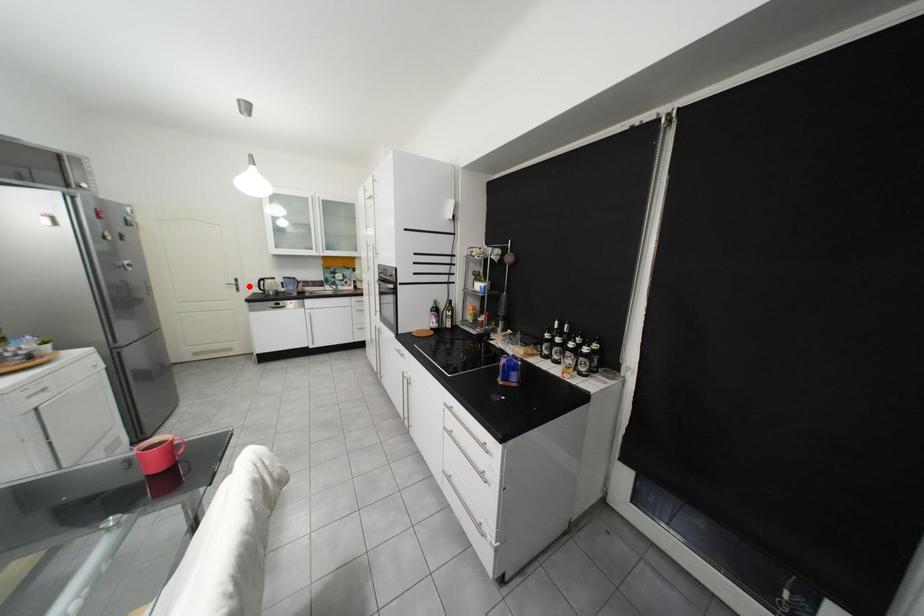
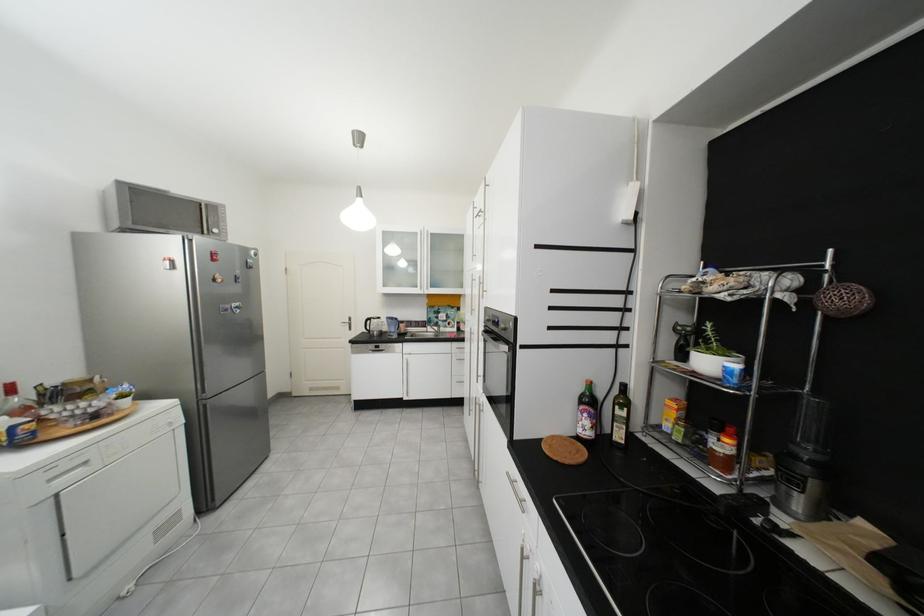
Question: I am providing you with two images of the same scene from different viewpoints. Image1 has a red point marked. In image2, the corresponding 3D location appears at what relative position? Reply with the corresponding letter.

Choices:
 (A) Closer
 (B) Farther

Answer: (B)